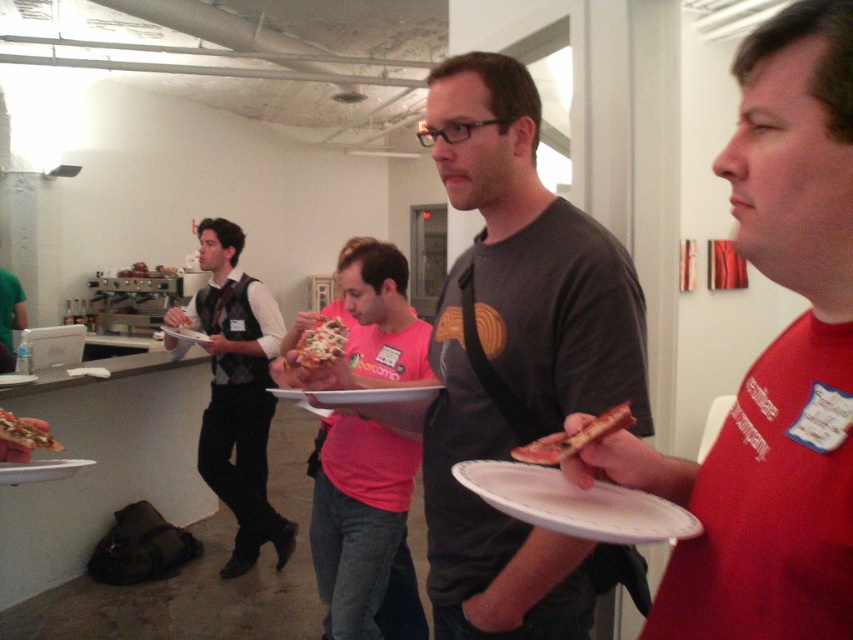
Based on the photo, based on the coordinates provided, where exactly is the red matte pizza slice at center located in the image?

The red matte pizza slice at center is located at point coordinates of 0.570 on the x axis and 0.907 on the y axis.